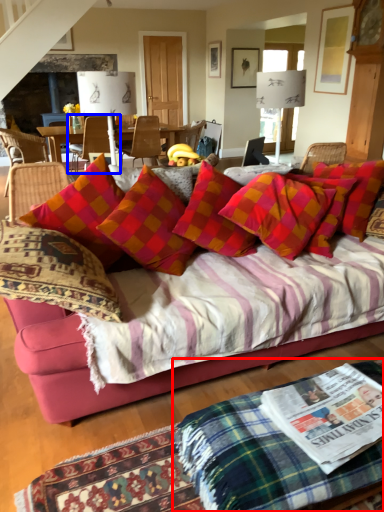
Question: Which object is closer to the camera taking this photo, quilt (highlighted by a red box) or chair (highlighted by a blue box)?

Choices:
 (A) quilt
 (B) chair

Answer: (A)